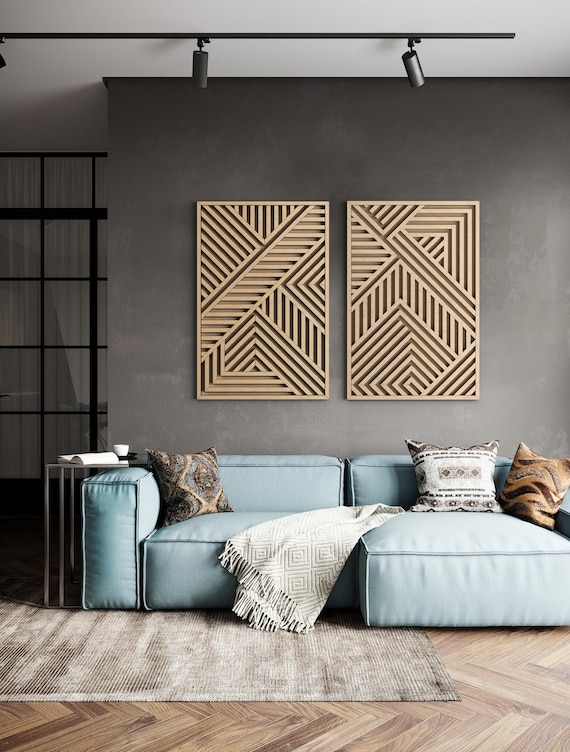
Where is `metal end table`? The height and width of the screenshot is (752, 570). metal end table is located at coordinates (47, 465).